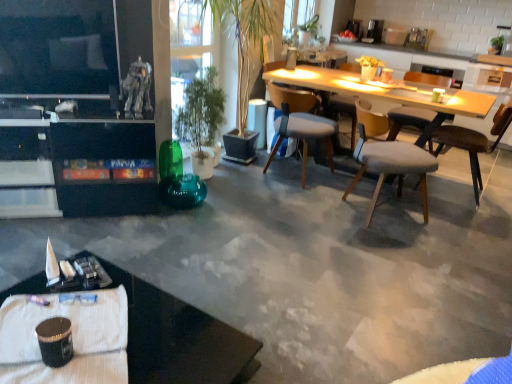
The height and width of the screenshot is (384, 512). I want to click on free location in front of metallic pen at lower left, so click(22, 329).